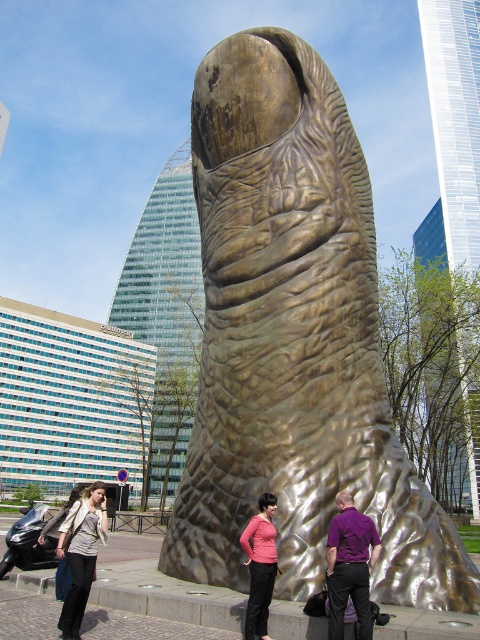
You are standing in front of the large metallic finger sculpture and notice two points marked on it. The first point is at coordinates point (216, 528) and the second is at point (370, 625). Which point is closer to you?

Point (216, 528) is further to the camera than point (370, 625), so the point closer to you is point (370, 625).

You are an artist planning to paint the scene. You need to decide which object to focus on first based on their sizes. Which object should you start with, the gold textured finger at center or the purple matte shirt at center?

The gold textured finger at center is larger in size than the purple matte shirt at center, so you should start with the gold textured finger at center to ensure proper scaling in your painting.

You are an art critic standing in front of the sculpture. You notice the gold textured finger at center and the pink matte shirt at center. Which object is closer to you?

The gold textured finger at center is closer to you because the pink matte shirt at center is behind it.